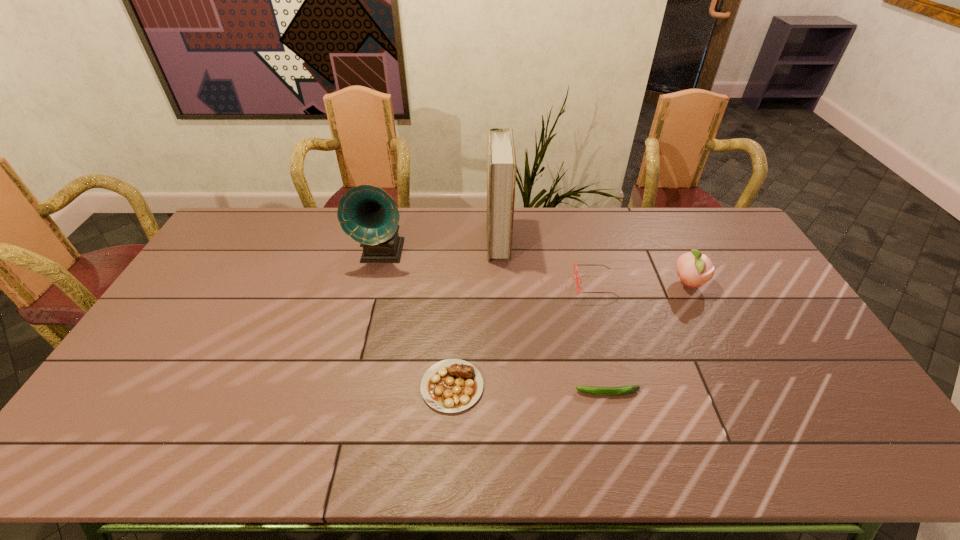
Find the location of a particular element. The width and height of the screenshot is (960, 540). free space between the leftmost object and the phonebook is located at coordinates (441, 246).

Locate an element on the screen. This screenshot has width=960, height=540. unoccupied area between the steak and the fifth shortest object is located at coordinates (418, 320).

At what (x,y) coordinates should I click in order to perform the action: click on free point between the leftmost object and the fourth object from right to left. Please return your answer as a coordinate pair (x, y). Looking at the image, I should click on (441, 246).

At what (x,y) coordinates should I click in order to perform the action: click on unoccupied position between the zucchini and the third object from left to right. Please return your answer as a coordinate pair (x, y). The image size is (960, 540). Looking at the image, I should click on (553, 316).

Locate an element on the screen. The height and width of the screenshot is (540, 960). blank region between the leftmost object and the peach is located at coordinates (536, 268).

At what (x,y) coordinates should I click in order to perform the action: click on vacant region between the peach and the phonebook. Please return your answer as a coordinate pair (x, y). This screenshot has height=540, width=960. Looking at the image, I should click on (593, 262).

This screenshot has height=540, width=960. Identify the location of empty space that is in between the tallest object and the rightmost object. (593, 262).

At what (x,y) coordinates should I click in order to perform the action: click on vacant area that lies between the phonograph_record and the rightmost object. Please return your answer as a coordinate pair (x, y). Looking at the image, I should click on (536, 268).

Where is `free space between the tallest object and the peach`? This screenshot has height=540, width=960. free space between the tallest object and the peach is located at coordinates (593, 262).

Identify the location of free point between the peach and the phonograph_record. (536, 268).